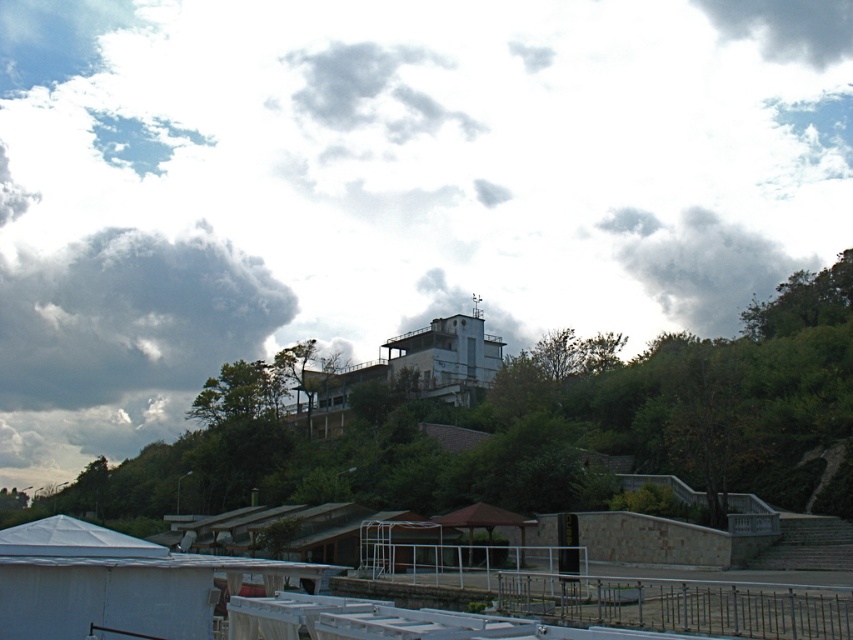
From the picture: You are an architect designing a new building that needs to consider weather patterns. You observe the dark gray fluffy cloud at upper left and the dark gray cloud at upper right in the image. Which cloud might indicate a higher chance of precipitation based on their sizes?

The dark gray fluffy cloud at upper left is bigger than the dark gray cloud at upper right. Generally, larger clouds with a fluffy appearance can hold more moisture, suggesting a higher potential for precipitation. Therefore, the dark gray fluffy cloud at upper left might indicate a higher chance of rain.

Based on the photo, you are a weather balloon operator who needs to launch a balloon that can travel 400 feet in any direction. If you launch from the middle of the large building, will your balloon reach either the dark gray fluffy cloud at upper left or the gray fluffy cloud at upper right?

The distance between the dark gray fluffy cloud at upper left and gray fluffy cloud at upper right is 375.85 feet. Since the balloon can travel 400 feet, it can reach both clouds as the maximum distance between them is within the balloon travel range.